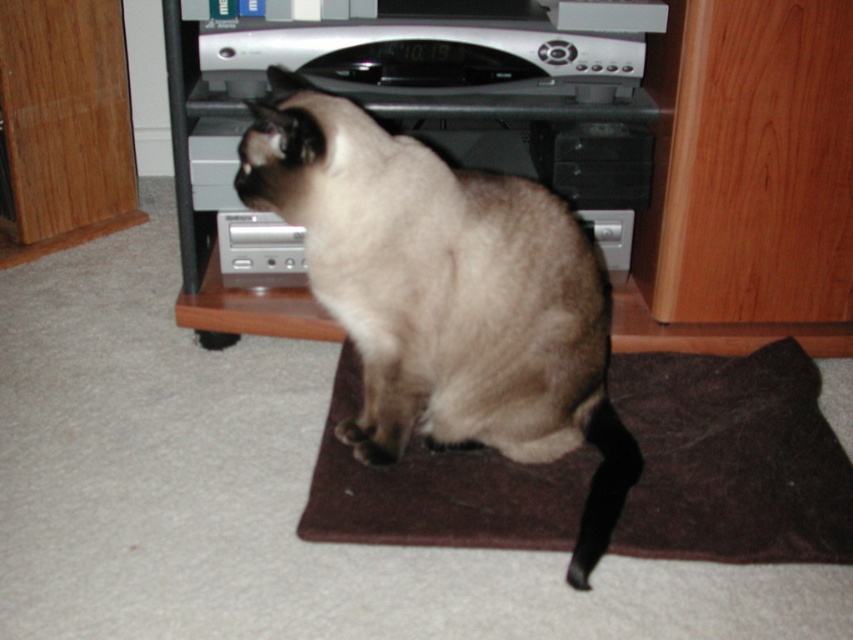
You are trying to place a new rug in the living room. The current brown felt mat at center is already occupying space. If the silver metallic entertainment center at center is placed on top of the mat, will it fit entirely within the mat?

The brown felt mat at center is larger in size than the silver metallic entertainment center at center, so yes, the silver metallic entertainment center at center will fit entirely within the mat.

You are a pet sitter who needs to place a new cat toy on the floor. The cat currently sits on the brown felt mat at center. To ensure the toy is visible to the cat but not directly under the silver metallic entertainment center at center, where should you place it?

The brown felt mat at center is positioned under the silver metallic entertainment center at center. To place the cat toy where it is visible but not under the entertainment center, place it on the light colored carpeted floor next to the brown felt mat at center, away from the area directly beneath the entertainment center.